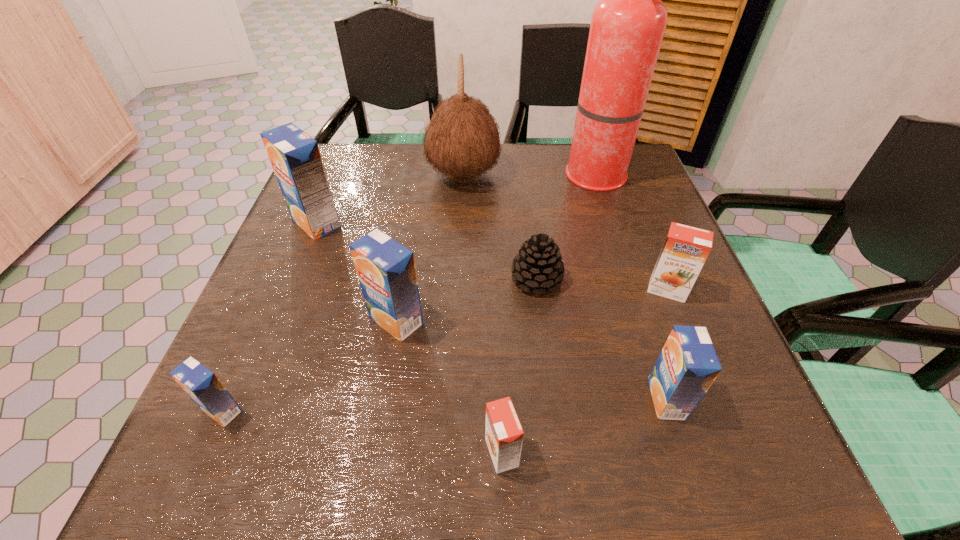
I want to click on free space located 0.110m on the back of the third blue orange_juice from left to right, so click(x=406, y=260).

At what (x,y) coordinates should I click in order to perform the action: click on vacant space located 0.080m on the back of the farther orange orange juice. Please return your answer as a coordinate pair (x, y). The height and width of the screenshot is (540, 960). Looking at the image, I should click on (652, 251).

I want to click on vacant space situated on the left of the fifth orange juice from left to right, so click(614, 399).

Find the location of a particular element. blank area located at the narrow end of the pinecone is located at coordinates (553, 414).

This screenshot has width=960, height=540. Find the location of `free location located on the back of the smallest blue orange_juice`. free location located on the back of the smallest blue orange_juice is located at coordinates (295, 246).

Locate an element on the screen. This screenshot has height=540, width=960. free space located on the right of the smaller orange orange juice is located at coordinates (552, 453).

Identify the location of fire extinguisher at the far edge. This screenshot has height=540, width=960. (627, 27).

At what (x,y) coordinates should I click in order to perform the action: click on coconut situated at the far edge. Please return your answer as a coordinate pair (x, y). Image resolution: width=960 pixels, height=540 pixels. Looking at the image, I should click on (462, 140).

I want to click on object at the near edge, so tap(504, 435).

This screenshot has height=540, width=960. Identify the location of fire extinguisher present at the right edge. (627, 27).